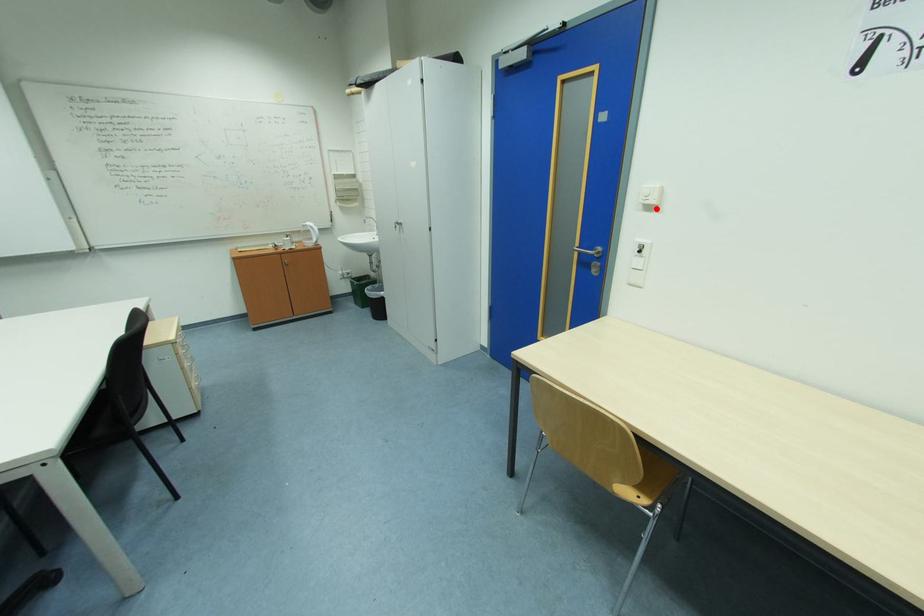
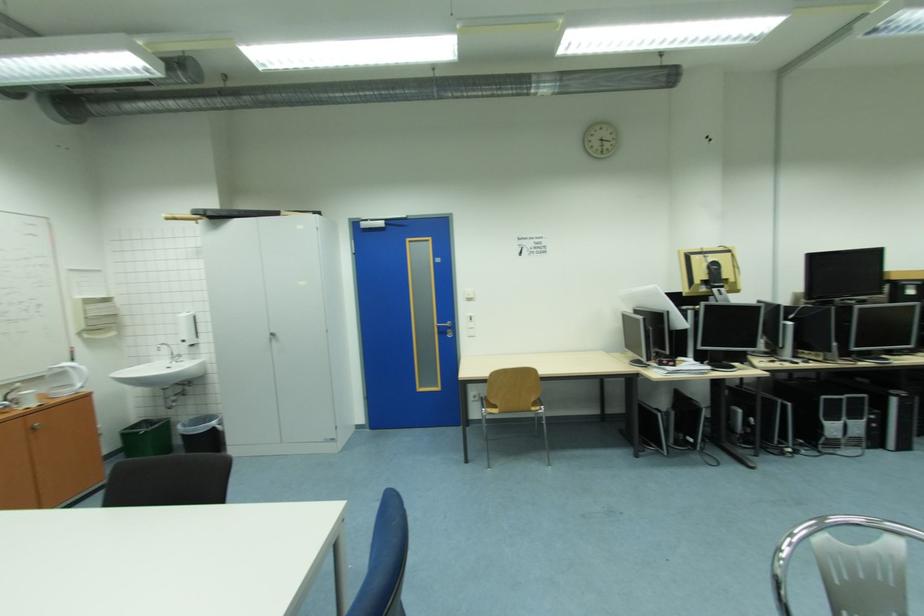
In the second image, find the point that corresponds to the highlighted location in the first image.

(477, 301)